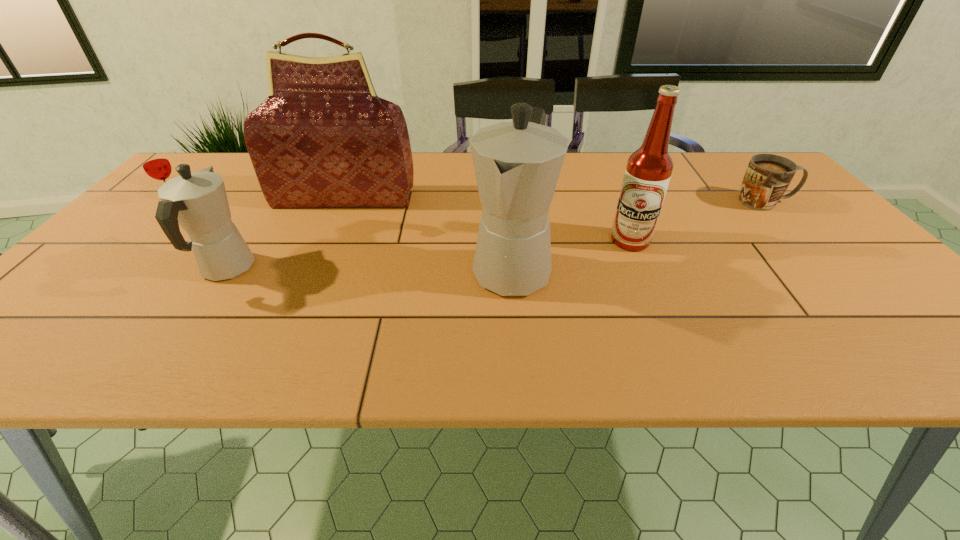
You are a GUI agent. You are given a task and a screenshot of the screen. Output one action in this format:
    pyautogui.click(x=<x>, y=<y>)
    Task: Click on the free region at the left edge of the desktop
    
    Given the screenshot: What is the action you would take?
    pyautogui.click(x=148, y=262)

In the image, there is a desktop. Where is `vacant space at the right edge`? The width and height of the screenshot is (960, 540). vacant space at the right edge is located at coordinates [x=824, y=273].

This screenshot has height=540, width=960. In order to click on free space between the shortest object and the leftmost object in this screenshot , I will do `click(470, 203)`.

This screenshot has height=540, width=960. I want to click on vacant area that lies between the third shortest object and the handbag, so click(x=285, y=233).

At what (x,y) coordinates should I click in order to perform the action: click on free space that is in between the fifth tallest object and the alcohol. Please return your answer as a coordinate pair (x, y). Looking at the image, I should click on (403, 222).

This screenshot has height=540, width=960. In order to click on vacant space that's between the left coffeepot and the taller coffeepot in this screenshot , I will do `click(369, 269)`.

Image resolution: width=960 pixels, height=540 pixels. I want to click on unoccupied area between the glass and the handbag, so click(260, 201).

I want to click on vacant point located between the handbag and the rightmost object, so click(555, 200).

Find the location of `free spot between the taller coffeepot and the handbag`. free spot between the taller coffeepot and the handbag is located at coordinates (428, 233).

This screenshot has height=540, width=960. Identify the location of free space between the leftmost object and the alcohol. (403, 222).